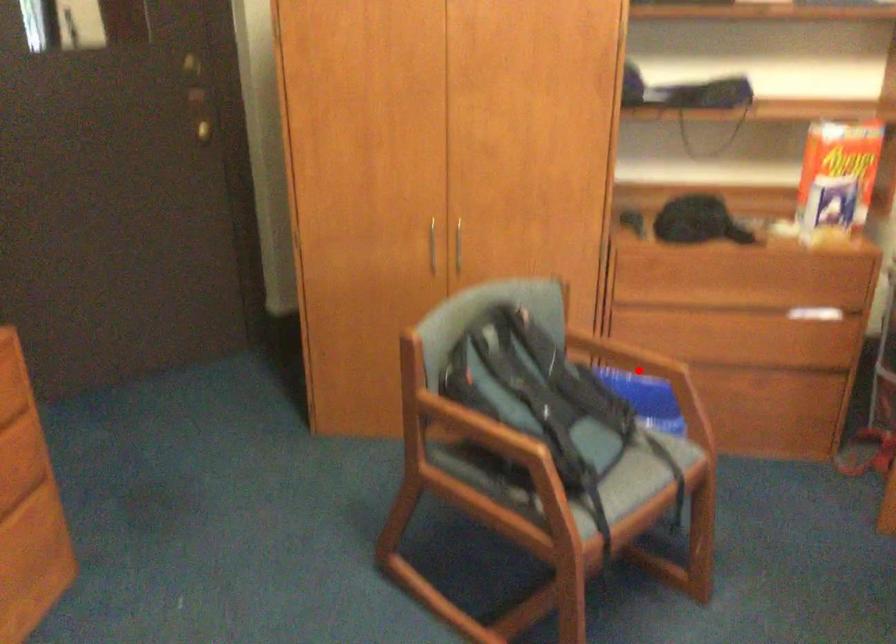
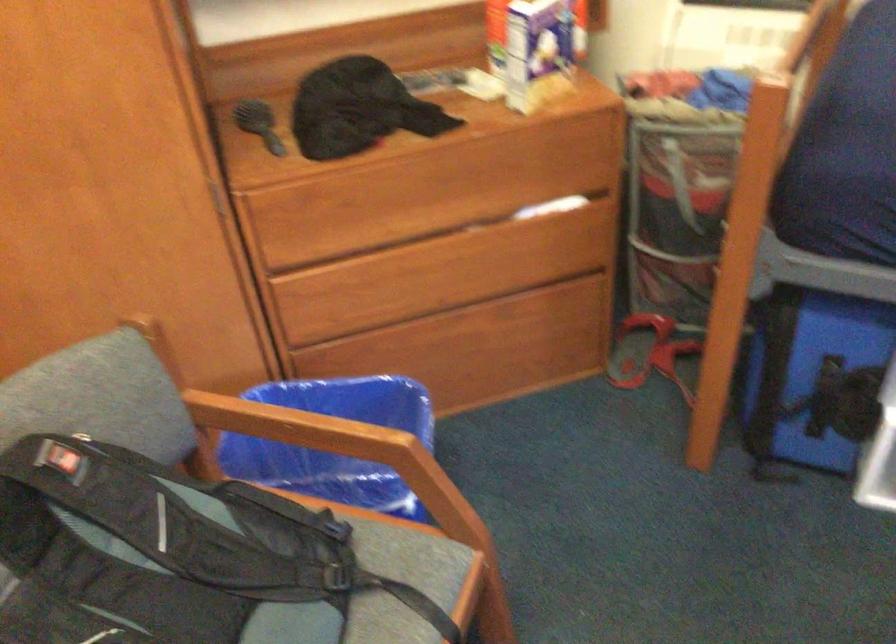
Locate, in the second image, the point that corresponds to the highlighted location in the first image.

(334, 440)